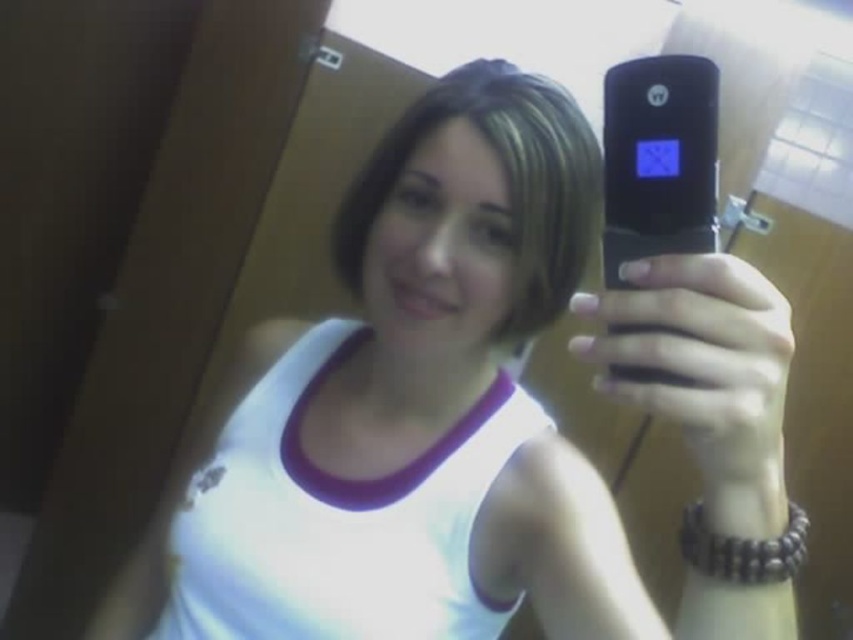
You are standing in a bathroom and want to take a selfie with a flip phone. The phone is at point (700,355). If you move your hands to the left by 0.1 units, will the phone still be visible in your selfie?

The phone at point (700,355) is at the center. Moving your hands left by 0.1 units would shift the phone slightly to the right in the frame, but since it was originally centered, it should still remain visible in the selfie.

You are trying to choose between the matte black phone at center and the black matte smartphone at center for a pocket that can only accommodate items up to 14 cm in height. Which one is more likely to fit?

The matte black phone at center is shorter than the black matte smartphone at center. Since the pocket can only hold items up to 14 cm, the matte black phone at center is more likely to fit.